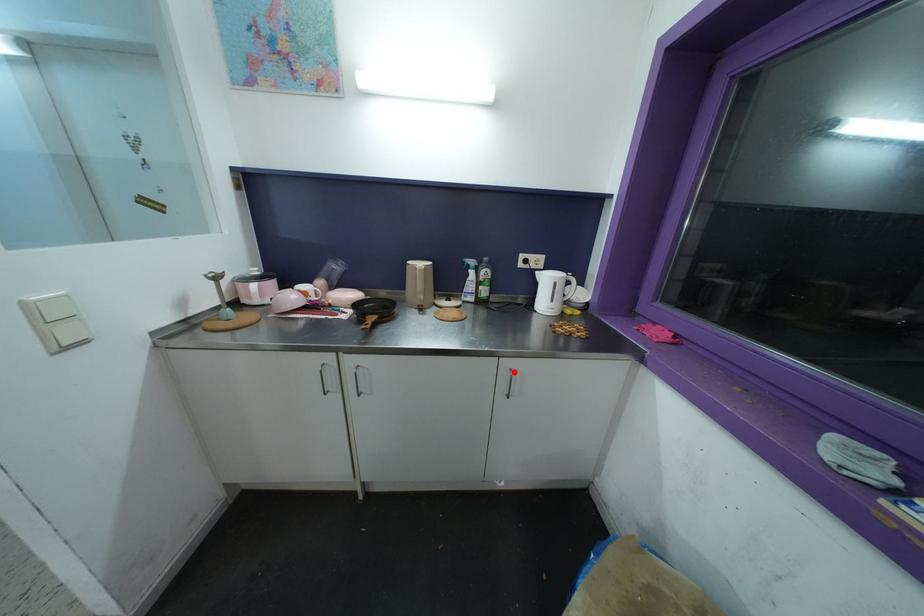
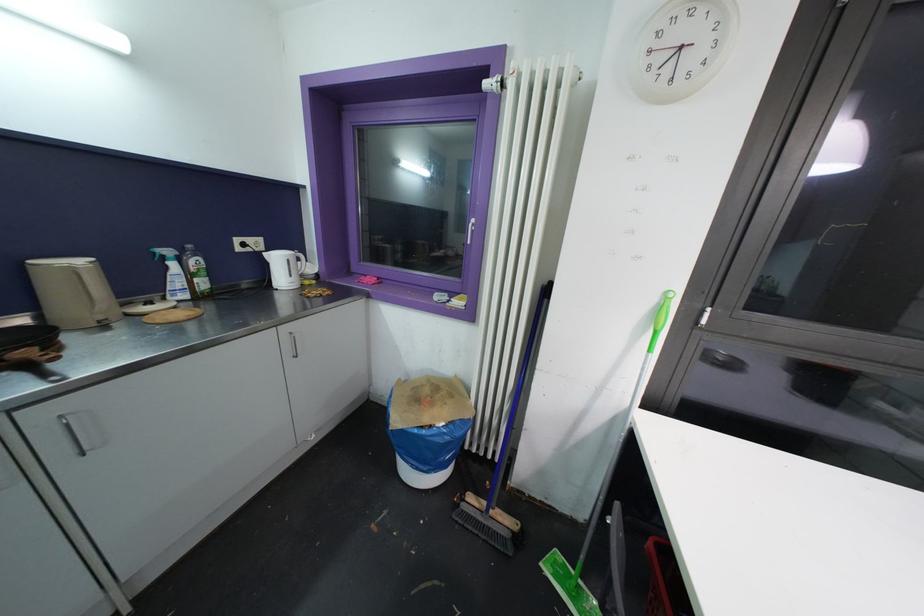
Question: A red point is marked in image1. In image2, is the corresponding 3D point closer to the camera or farther? Reply with the corresponding letter.

Choices:
 (A) The corresponding 3D point is closer.
 (B) The corresponding 3D point is farther.

Answer: (A)